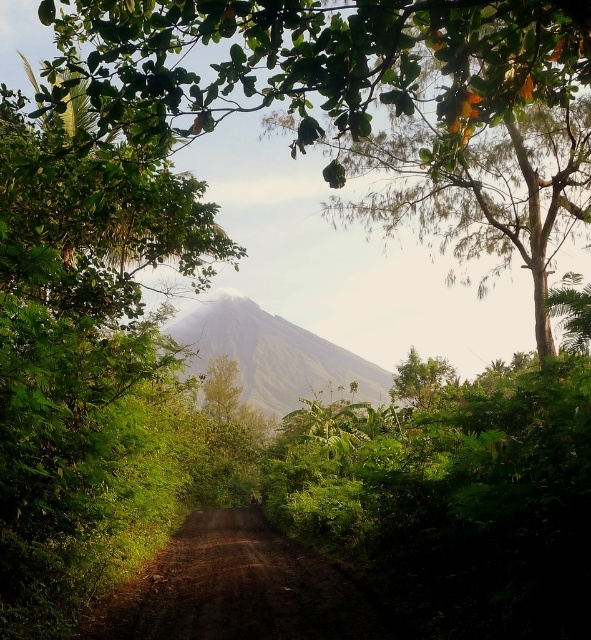
Is brown dirt track at center to the left of green grassy mountain at center from the viewer's perspective?

Indeed, brown dirt track at center is positioned on the left side of green grassy mountain at center.

Between point (323, 632) and point (339, 348), which one is positioned in front?

Positioned in front is point (323, 632).

Locate an element on the screen. brown dirt track at center is located at coordinates (236, 588).

Can you confirm if green leafy tree at center is taller than brown dirt track at center?

In fact, green leafy tree at center may be shorter than brown dirt track at center.

Is point (0, 481) behind point (79, 627)?

No, (0, 481) is closer to viewer.

Identify the location of green leafy tree at center. (77, 346).

Is green leafy tree at center closer to camera compared to green grassy mountain at center?

Yes, it is.

Locate an element on the screen. The width and height of the screenshot is (591, 640). green leafy tree at center is located at coordinates (77, 346).